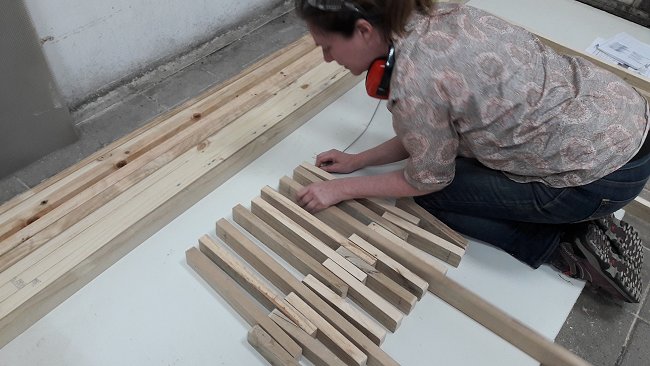
Identify the location of wall. The height and width of the screenshot is (366, 650). (107, 35).